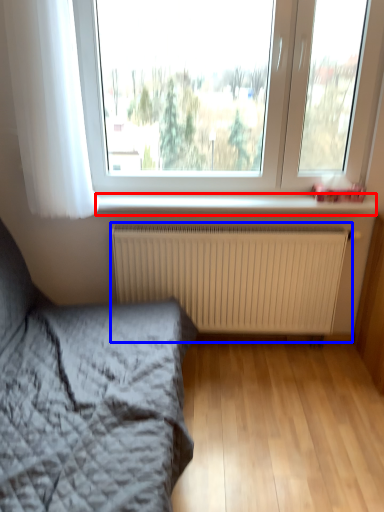
Question: Which point is closer to the camera, window sill (highlighted by a red box) or radiator (highlighted by a blue box)?

Choices:
 (A) window sill
 (B) radiator

Answer: (A)